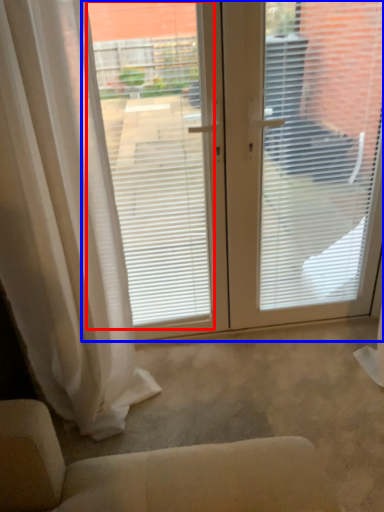
Question: Which object is closer to the camera taking this photo, window screen (highlighted by a red box) or window screen (highlighted by a blue box)?

Choices:
 (A) window screen
 (B) window screen

Answer: (A)